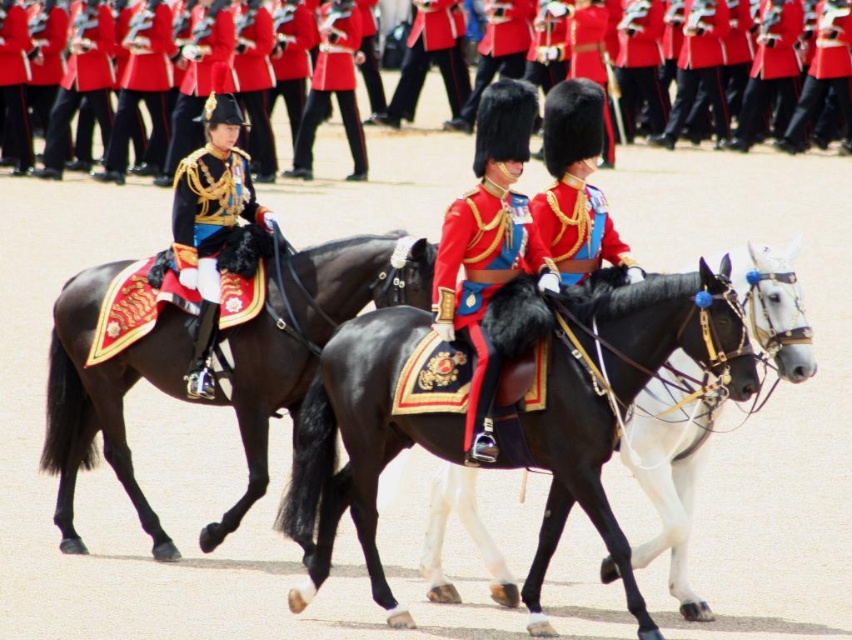
You are a photographer at the military parade. You need to capture a closeup shot of the shiny gold armor at center and the shiny red fabric uniform at center. Which one would require you to zoom in more to focus on its details?

The shiny gold armor at center has a smaller size compared to the shiny red fabric uniform at center, so you would need to zoom in more to focus on the details of the shiny gold armor at center.

You are a photographer positioned at the origin of the coordinate system. You need to capture a closeup shot of the shiny gold armor at center. According to the coordinates provided, in which direction should you move your camera to frame the armor properly?

The shiny gold armor at center is located at point 0.353 on the x axis and 0.246 on the y axis. Since the origin is at the bottom left corner, you should move your camera to the right and slightly upwards to align with the coordinates (209, 225).